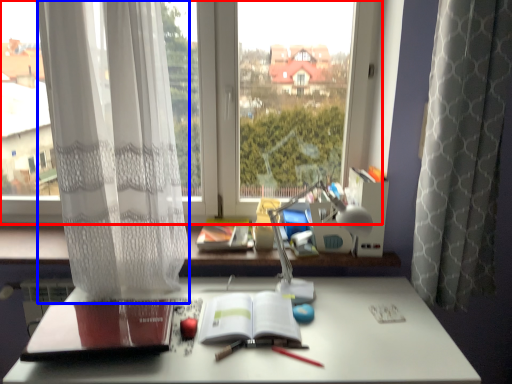
Question: Which object appears farthest to the camera in this image, window (highlighted by a red box) or curtain (highlighted by a blue box)?

Choices:
 (A) window
 (B) curtain

Answer: (A)